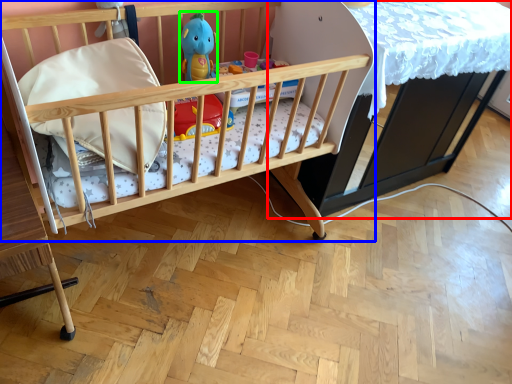
Question: Based on their relative distances, which object is farther from table (highlighted by a red box)? Choose from infant bed (highlighted by a blue box) and toy (highlighted by a green box).

Choices:
 (A) infant bed
 (B) toy

Answer: (B)